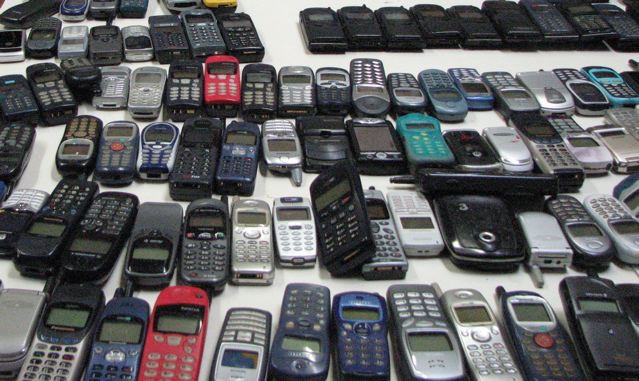
Image resolution: width=639 pixels, height=381 pixels. Find the location of `led`. led is located at coordinates (174, 318).